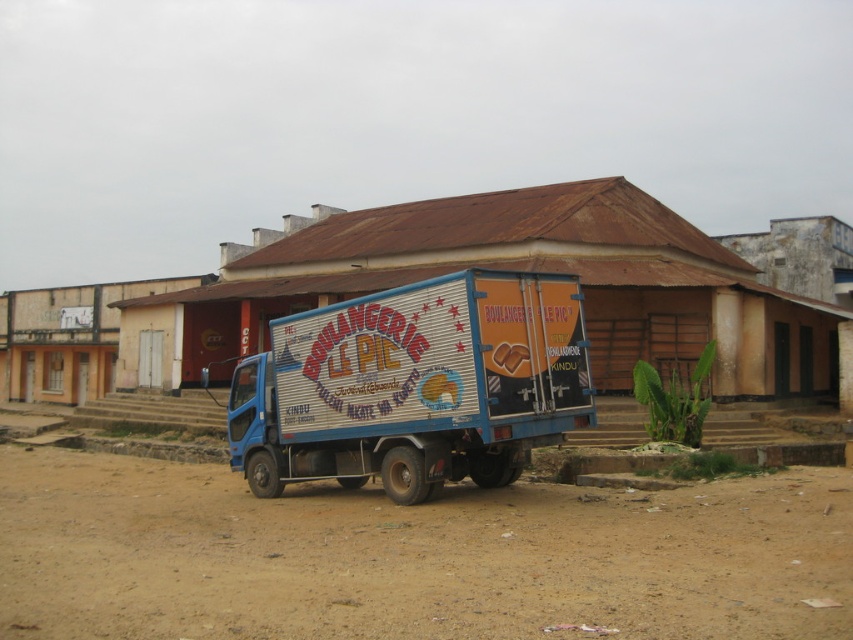
Is brown sandy dirt at lower center bigger than blue metallic truck at center?

Indeed, brown sandy dirt at lower center has a larger size compared to blue metallic truck at center.

Which is below, brown sandy dirt at lower center or blue metallic truck at center?

brown sandy dirt at lower center is below.

Measure the distance between brown sandy dirt at lower center and camera.

brown sandy dirt at lower center is 5.92 meters from camera.

Where is `brown sandy dirt at lower center`? brown sandy dirt at lower center is located at coordinates (413, 556).